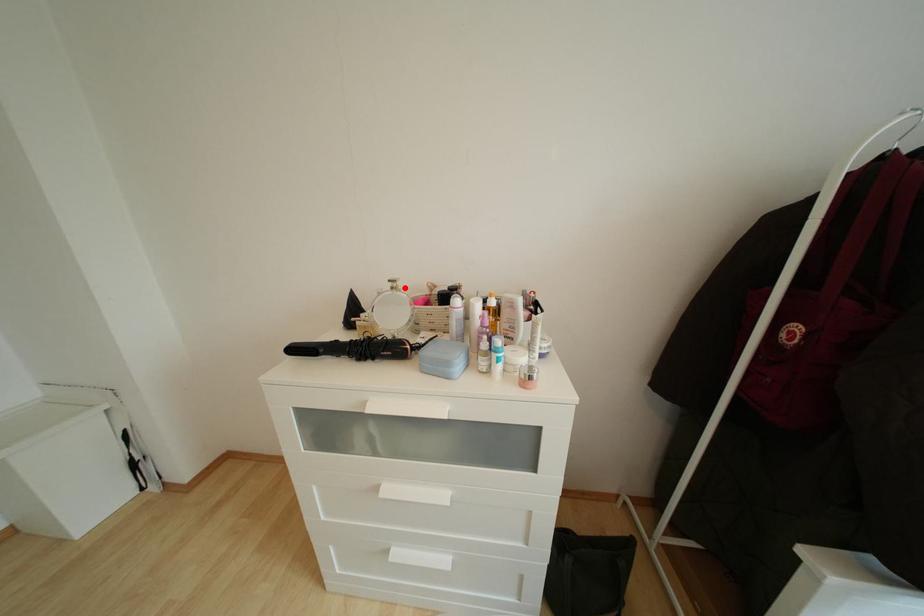
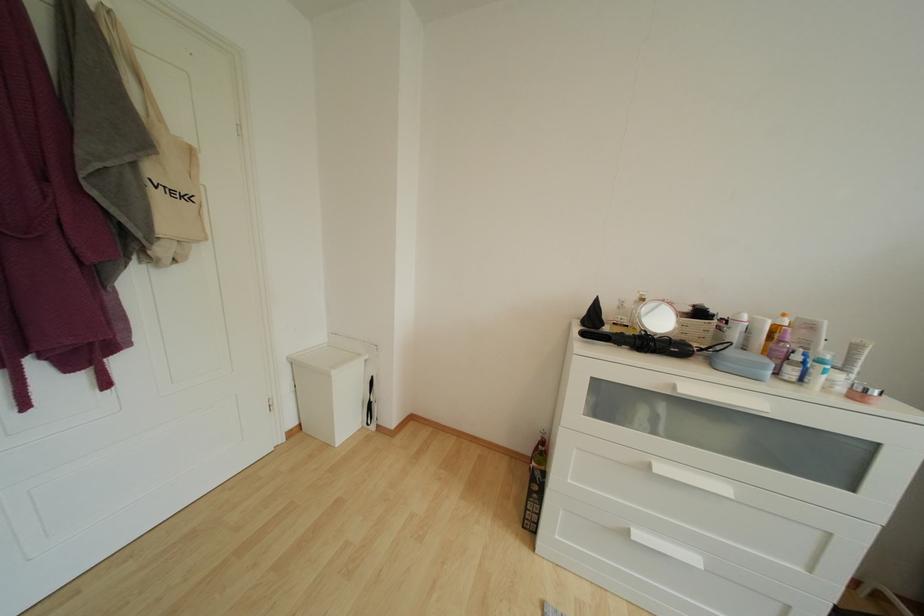
Locate, in the second image, the point that corresponds to the highlighted location in the first image.

(651, 301)